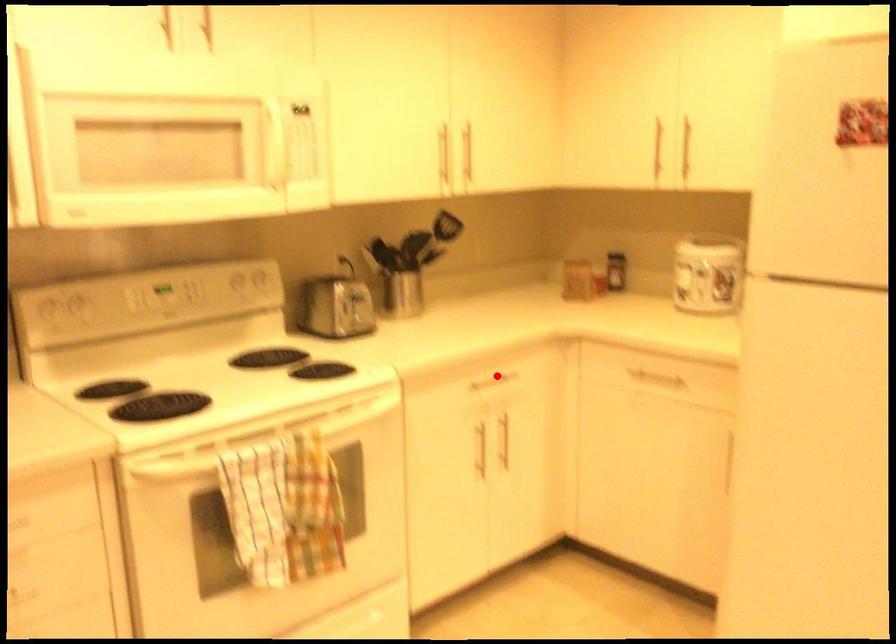
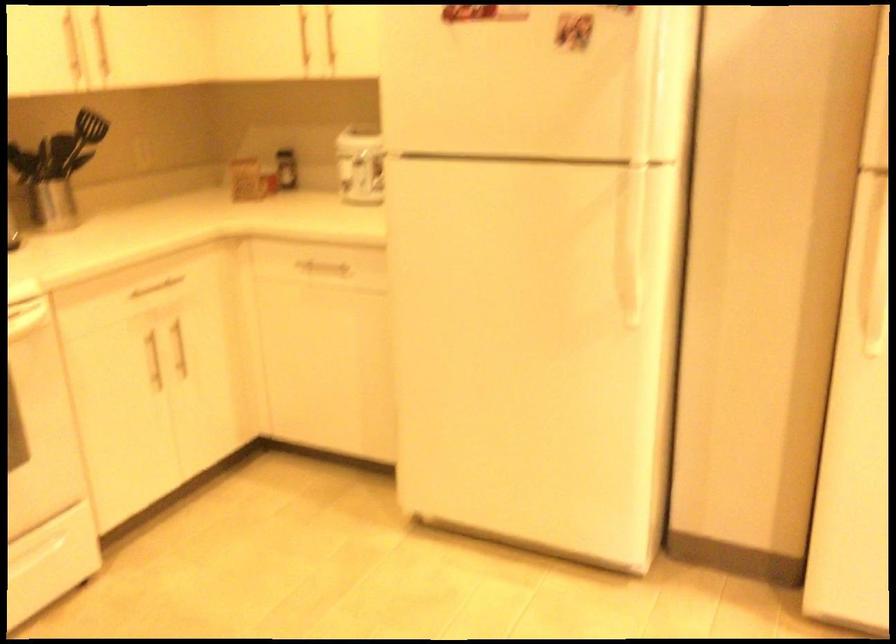
The point at the highlighted location is marked in the first image. Where is the corresponding point in the second image?

(159, 283)